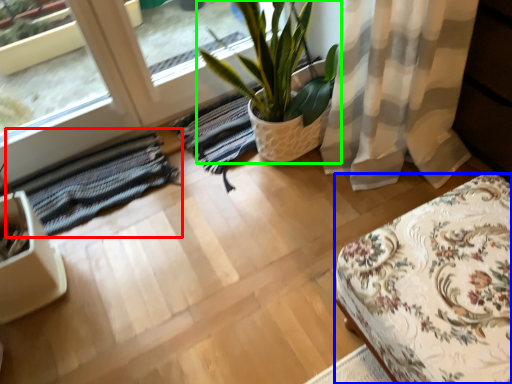
Question: Which object is positioned farthest from mat (highlighted by a red box)? Select from furniture (highlighted by a blue box) and houseplant (highlighted by a green box).

Choices:
 (A) furniture
 (B) houseplant

Answer: (A)